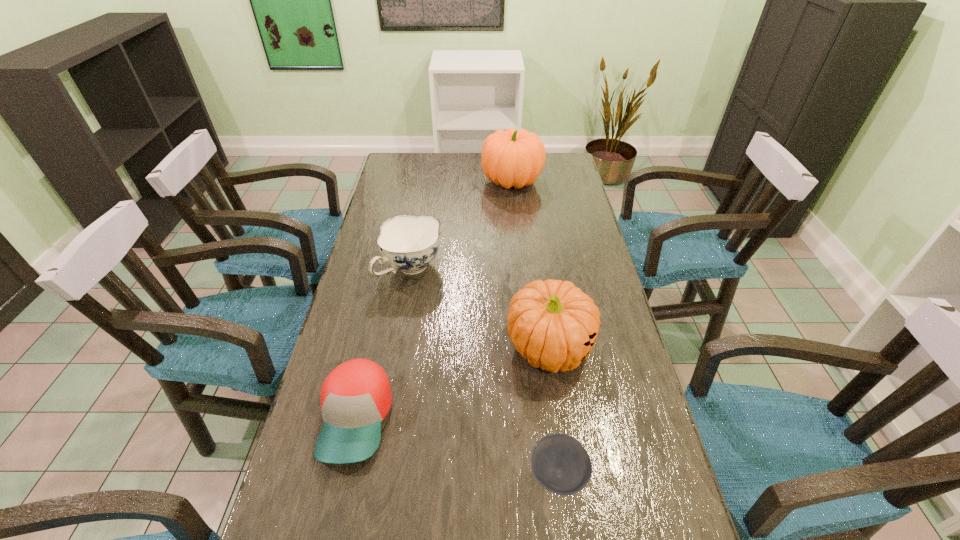
Where is `the farther pumpkin`? the farther pumpkin is located at coordinates (510, 158).

The width and height of the screenshot is (960, 540). In order to click on the nearer pumpkin in this screenshot , I will do `click(553, 324)`.

This screenshot has height=540, width=960. What are the coordinates of `the second farthest object` in the screenshot? It's located at (408, 243).

Where is `the third tallest object`? the third tallest object is located at coordinates (408, 243).

Locate an element on the screen. the fourth tallest object is located at coordinates (355, 398).

Find the location of `the shortest object`. the shortest object is located at coordinates (559, 462).

The width and height of the screenshot is (960, 540). I want to click on vacant space situated 0.080m on the back of the farthest object, so click(510, 157).

Locate an element on the screen. The height and width of the screenshot is (540, 960). free point located on the surface of the nearer pumpkin is located at coordinates (576, 529).

I want to click on vacant region located on the right of the second farthest object, so click(496, 269).

I want to click on free space located at the brim of the baseball cap, so pos(336,507).